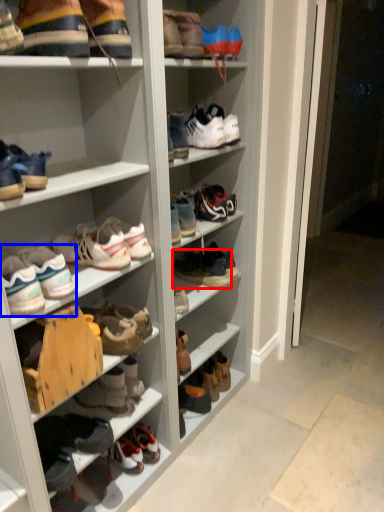
Question: Which object is further to the camera taking this photo, footwear (highlighted by a red box) or footwear (highlighted by a blue box)?

Choices:
 (A) footwear
 (B) footwear

Answer: (A)